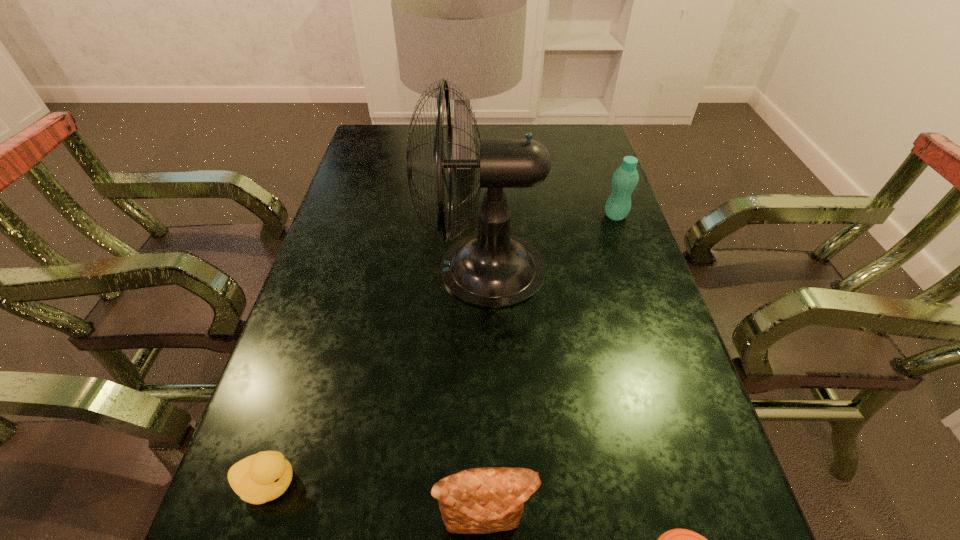
Where is `the farthest object`? the farthest object is located at coordinates (459, 0).

Locate an element on the screen. Image resolution: width=960 pixels, height=540 pixels. the fourth nearest object is located at coordinates (492, 269).

Identify the location of the rightmost object. (625, 179).

In order to click on the fifth nearest object in this screenshot , I will do [625, 179].

Where is `duck`? The width and height of the screenshot is (960, 540). duck is located at coordinates (262, 477).

Find the location of a particular element. The image size is (960, 540). vacant region located on the front-facing side of the farthest object is located at coordinates (574, 163).

Image resolution: width=960 pixels, height=540 pixels. Identify the location of free space located 0.190m on the front-facing side of the fan. (347, 268).

Find the location of a particular element. vacant position located 0.220m on the front-facing side of the fan is located at coordinates (335, 268).

This screenshot has width=960, height=540. In order to click on vacant space positioned 0.120m on the front-facing side of the fan in this screenshot , I will do `click(374, 268)`.

The width and height of the screenshot is (960, 540). What are the coordinates of `free space located on the left of the rightmost object` in the screenshot? It's located at (544, 215).